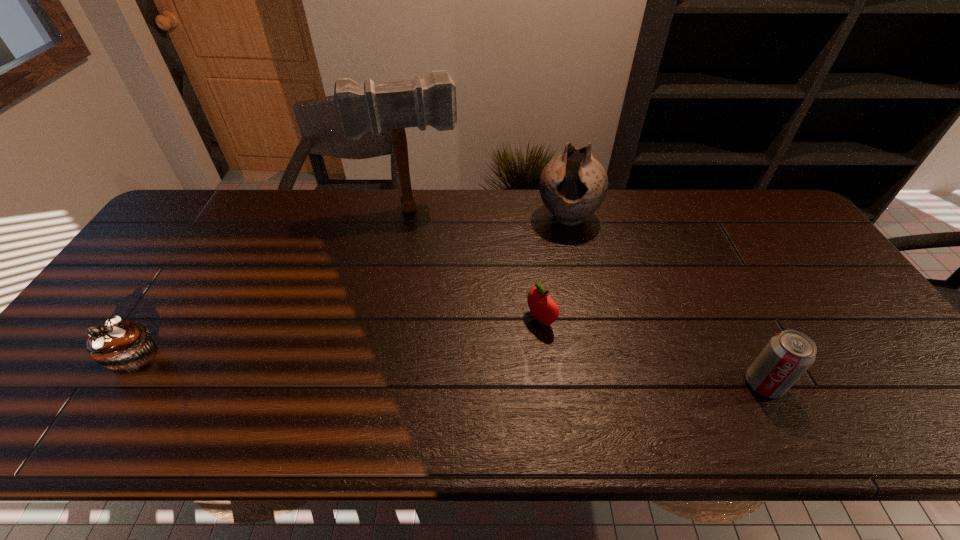
At what (x,y) coordinates should I click in order to perform the action: click on cupcake that is at the near edge. Please return your answer as a coordinate pair (x, y). The width and height of the screenshot is (960, 540). Looking at the image, I should click on (124, 347).

I want to click on soda can present at the near edge, so click(787, 356).

I want to click on object at the left edge, so click(x=124, y=347).

The image size is (960, 540). In order to click on object located in the near left corner section of the desktop in this screenshot , I will do `click(124, 347)`.

The image size is (960, 540). I want to click on vacant region at the far edge, so click(609, 201).

Locate an element on the screen. The height and width of the screenshot is (540, 960). vacant space at the near edge of the desktop is located at coordinates (507, 368).

Where is `free space at the right edge of the desktop`? The height and width of the screenshot is (540, 960). free space at the right edge of the desktop is located at coordinates (805, 252).

What are the coordinates of `free space at the far left corner of the desktop` in the screenshot? It's located at (197, 222).

Identify the location of vacant space at the far right corner of the desktop. This screenshot has width=960, height=540. (756, 200).

Find the location of `vacant point at the near right corner`. vacant point at the near right corner is located at coordinates click(873, 381).